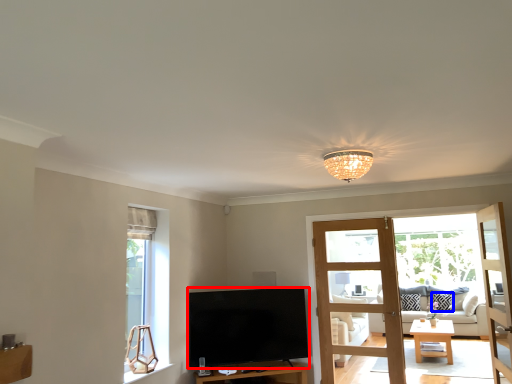
Question: Which of the following is the closest to the observer, television (highlighted by a red box) or pillow (highlighted by a blue box)?

Choices:
 (A) television
 (B) pillow

Answer: (A)